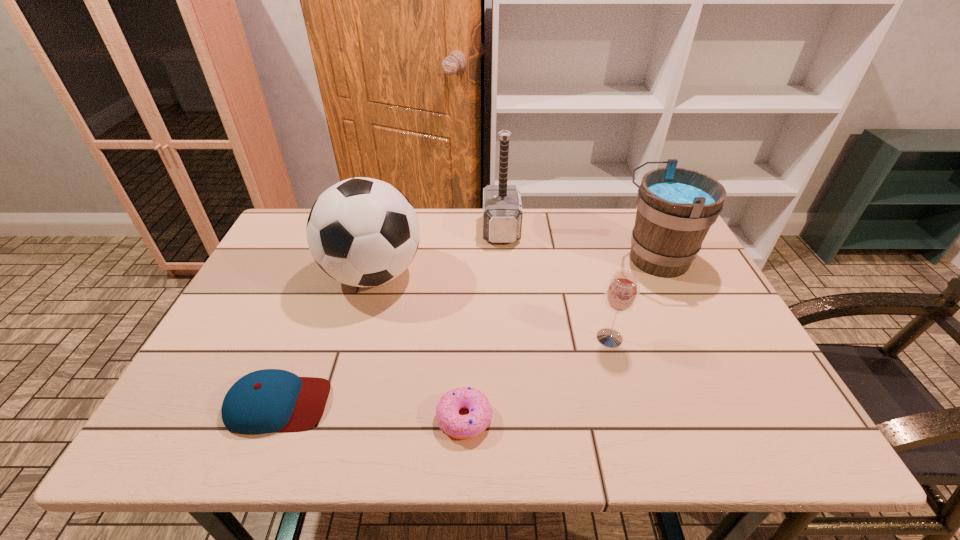
Locate an element on the screen. The height and width of the screenshot is (540, 960). baseball cap present at the near edge is located at coordinates tap(270, 400).

This screenshot has height=540, width=960. I want to click on doughnut present at the near edge, so click(458, 426).

Locate an element on the screen. object that is positioned at the left edge is located at coordinates (270, 400).

Find the location of a particular element. This screenshot has height=540, width=960. object that is at the right edge is located at coordinates [676, 207].

Locate an element on the screen. object that is positioned at the near left corner is located at coordinates (270, 400).

Locate an element on the screen. This screenshot has width=960, height=540. object that is positioned at the far right corner is located at coordinates (676, 207).

Locate an element on the screen. Image resolution: width=960 pixels, height=540 pixels. free space at the far edge of the desktop is located at coordinates (528, 210).

The width and height of the screenshot is (960, 540). What are the coordinates of `free space at the right edge of the desktop` in the screenshot? It's located at (701, 356).

In the image, there is a desktop. What are the coordinates of `vacant region at the near right corner` in the screenshot? It's located at (737, 416).

This screenshot has width=960, height=540. I want to click on vacant area that lies between the baseball cap and the soccer ball, so click(325, 339).